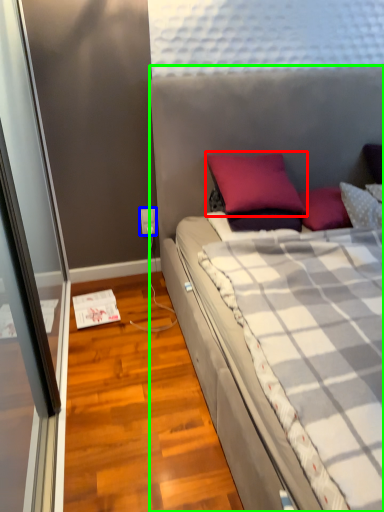
Question: Which object is positioned farthest from pillow (highlighted by a red box)? Select from power outlet (highlighted by a blue box) and bed (highlighted by a green box).

Choices:
 (A) power outlet
 (B) bed

Answer: (A)